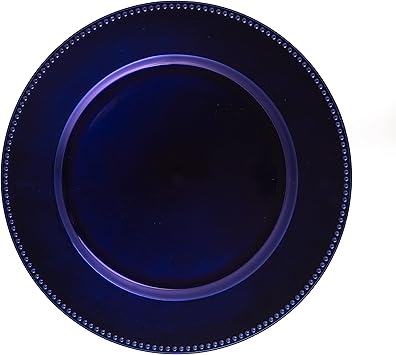
In order to click on centermost point of charger plate in this screenshot , I will do `click(174, 173)`.